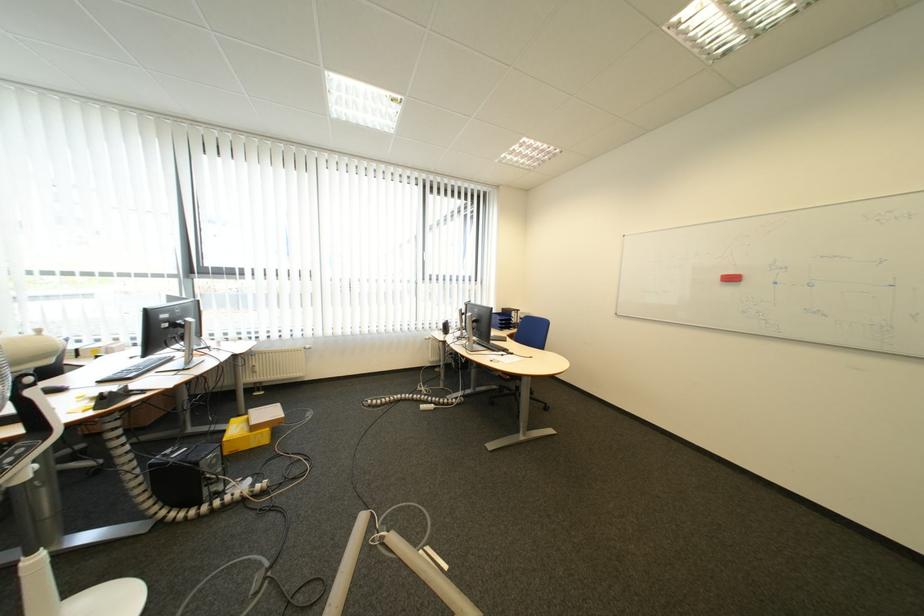
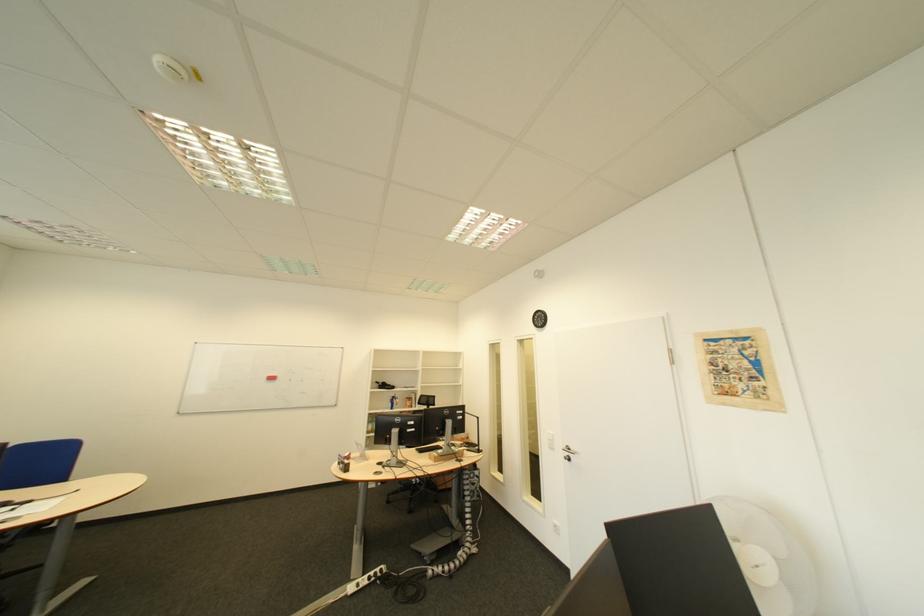
The point at (745, 280) is marked in the first image. Where is the corresponding point in the second image?

(285, 379)